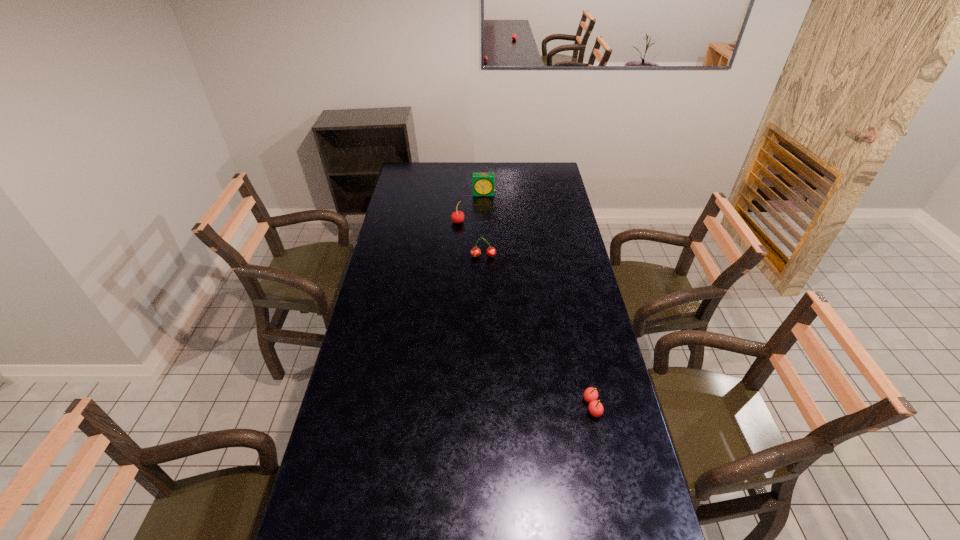
The width and height of the screenshot is (960, 540). Identify the location of the third nearest object. (458, 216).

The width and height of the screenshot is (960, 540). Find the location of `the farthest cherry`. the farthest cherry is located at coordinates (458, 216).

This screenshot has height=540, width=960. I want to click on alarm clock, so click(483, 183).

The image size is (960, 540). Find the location of `the third farthest object`. the third farthest object is located at coordinates (475, 251).

This screenshot has width=960, height=540. I want to click on the second farthest cherry, so click(x=475, y=251).

Where is `the rightmost object`? The width and height of the screenshot is (960, 540). the rightmost object is located at coordinates (596, 409).

Identify the location of the nearest cherry. (596, 409).

You are a GUI agent. You are given a task and a screenshot of the screen. Output one action in this format:
    pyautogui.click(x=<x>, y=<y>)
    Task: Click on the vacant space situated on the right of the leftmost cherry
    Image resolution: width=960 pixels, height=540 pixels.
    Given the screenshot: What is the action you would take?
    pyautogui.click(x=542, y=222)

Where is `vacant region located on the front-facing side of the farthest object`? The image size is (960, 540). vacant region located on the front-facing side of the farthest object is located at coordinates (484, 215).

Locate an element on the screen. The width and height of the screenshot is (960, 540). free space located 0.070m with stems pointing upwards on the second cherry from left to right is located at coordinates (484, 271).